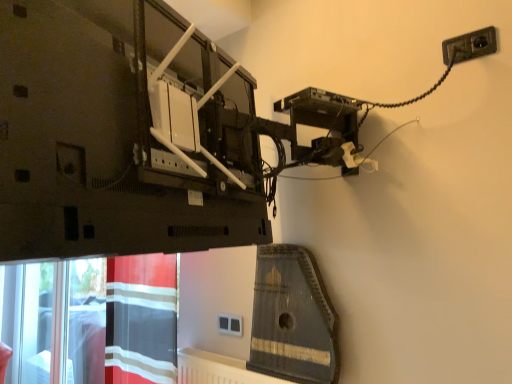
Question: Considering the relative sizes of black plastic socket at upper right and wooden harp at center in the image provided, is black plastic socket at upper right smaller than wooden harp at center?

Choices:
 (A) yes
 (B) no

Answer: (A)

Question: Is black plastic socket at upper right taller than wooden harp at center?

Choices:
 (A) yes
 (B) no

Answer: (B)

Question: Is black plastic socket at upper right to the right of wooden harp at center from the viewer's perspective?

Choices:
 (A) yes
 (B) no

Answer: (A)

Question: Is wooden harp at center completely or partially inside black plastic socket at upper right?

Choices:
 (A) no
 (B) yes

Answer: (A)

Question: Is black plastic socket at upper right in front of wooden harp at center?

Choices:
 (A) no
 (B) yes

Answer: (B)

Question: Considering the positions of black plastic socket at upper right and red striped fabric at lower left in the image, is black plastic socket at upper right wider or thinner than red striped fabric at lower left?

Choices:
 (A) wide
 (B) thin

Answer: (B)

Question: From a real-world perspective, is black plastic socket at upper right above or below red striped fabric at lower left?

Choices:
 (A) above
 (B) below

Answer: (A)

Question: Based on their positions, is black plastic socket at upper right located to the left or right of red striped fabric at lower left?

Choices:
 (A) left
 (B) right

Answer: (B)

Question: Which is correct: black plastic socket at upper right is inside red striped fabric at lower left, or outside of it?

Choices:
 (A) outside
 (B) inside

Answer: (A)

Question: In the image, is wooden harp at center positioned in front of or behind red striped fabric at lower left?

Choices:
 (A) behind
 (B) front

Answer: (B)

Question: Looking at the image, does wooden harp at center seem bigger or smaller compared to red striped fabric at lower left?

Choices:
 (A) big
 (B) small

Answer: (B)

Question: Would you say wooden harp at center is to the left or to the right of red striped fabric at lower left in the picture?

Choices:
 (A) left
 (B) right

Answer: (B)

Question: Is wooden harp at center taller or shorter than red striped fabric at lower left?

Choices:
 (A) short
 (B) tall

Answer: (A)

Question: Considering the positions of point (234, 327) and point (264, 294), is point (234, 327) closer or farther from the camera than point (264, 294)?

Choices:
 (A) closer
 (B) farther

Answer: (B)

Question: Based on their sizes in the image, would you say white plastic socket at center is bigger or smaller than wooden harp at center?

Choices:
 (A) big
 (B) small

Answer: (B)